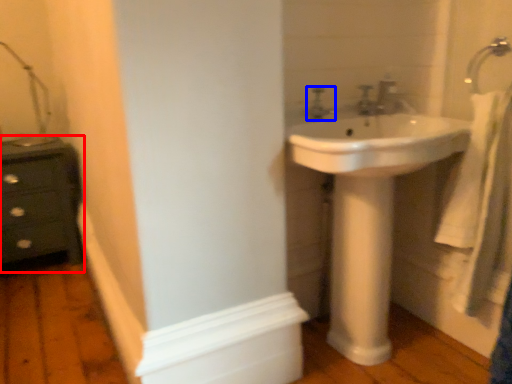
Question: Which object appears farthest to the camera in this image, chest of drawers (highlighted by a red box) or tap (highlighted by a blue box)?

Choices:
 (A) chest of drawers
 (B) tap

Answer: (A)